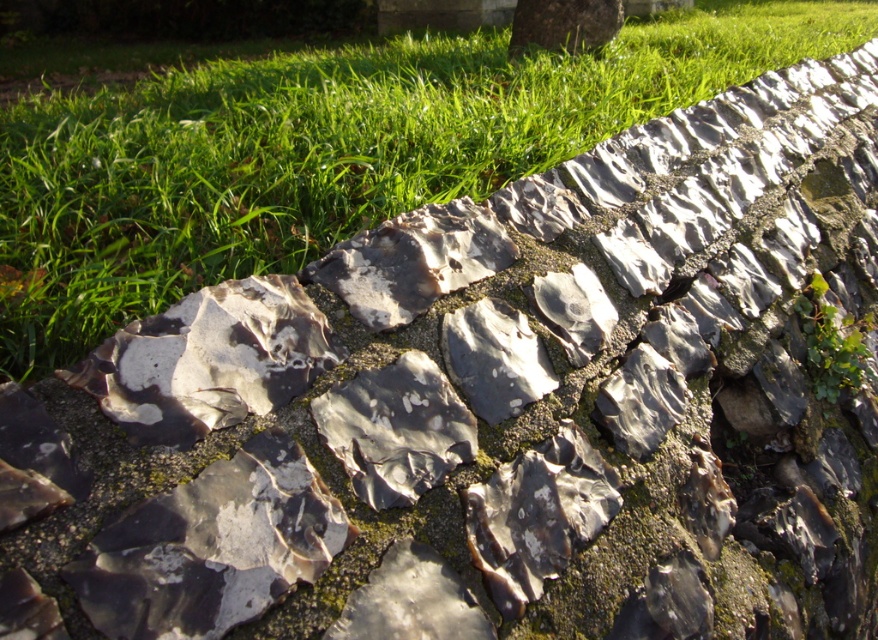
You are standing in a garden and see the green grass at upper center and the green leafy tree at upper center. Which object is closer to the ground?

The green grass at upper center is positioned under the green leafy tree at upper center, so the grass is closer to the ground.

You are a gardener observing the stone wall and want to plant flowers in the green grass at upper center and under the green leafy tree at upper center. Which area has more space available for planting?

The green leafy tree at upper center has more space available for planting because the green grass at upper center occupies less space than the green leafy tree at upper center.

You are a gardener looking at the stone wall with green grass at upper center and green leafy tree at upper center. Which of these two has a wider spread?

The green grass at upper center has a wider spread than the green leafy tree at upper center as stated in the description.